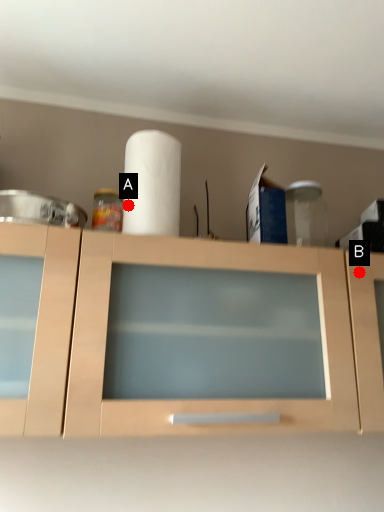
Question: Two points are circled on the image, labeled by A and B beside each circle. Which of the following is the farthest from the observer?

Choices:
 (A) A is further
 (B) B is further

Answer: (B)